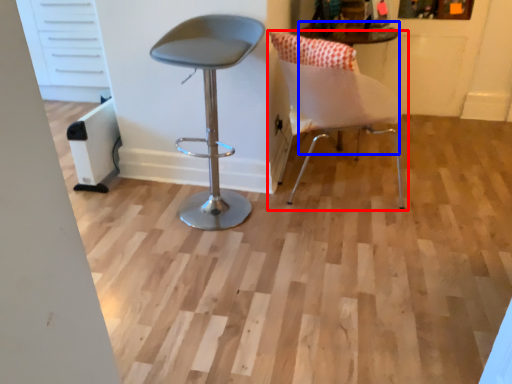
Question: Which of the following is the closest to the observer, chair (highlighted by a red box) or round table (highlighted by a blue box)?

Choices:
 (A) chair
 (B) round table

Answer: (B)